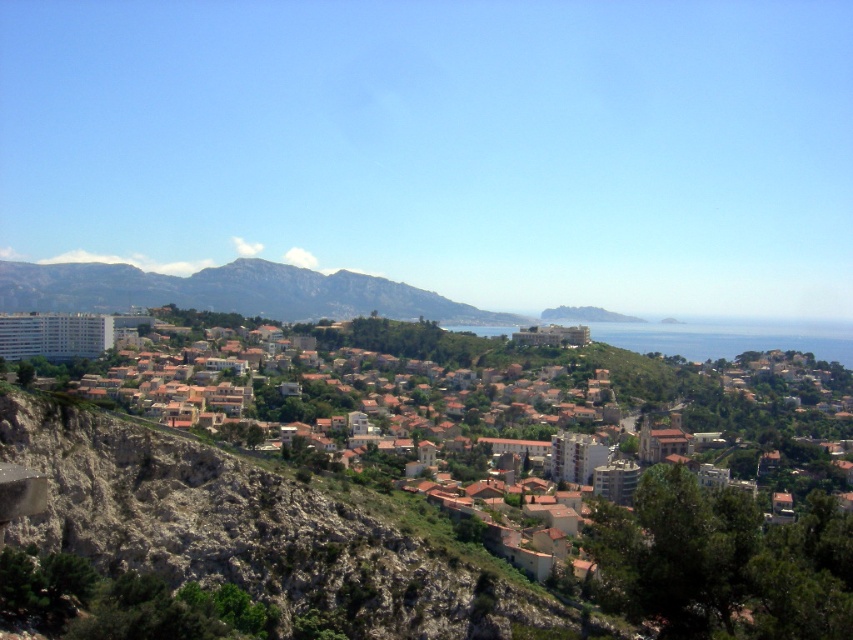
Question: Is white concrete buildings at center further to the viewer compared to rocky brown mountain at center?

Choices:
 (A) no
 (B) yes

Answer: (A)

Question: Is white concrete buildings at center closer to camera compared to blue water at center?

Choices:
 (A) no
 (B) yes

Answer: (B)

Question: Based on their relative distances, which object is farther from the blue water at center?

Choices:
 (A) white concrete buildings at center
 (B) rocky brown mountain at center

Answer: (A)

Question: Which of the following is the closest to the observer?

Choices:
 (A) rocky brown mountain at center
 (B) white concrete buildings at center

Answer: (B)

Question: Does white concrete buildings at center appear on the left side of rocky brown mountain at center?

Choices:
 (A) yes
 (B) no

Answer: (B)

Question: Among these objects, which one is nearest to the camera?

Choices:
 (A) rocky brown mountain at center
 (B) white concrete buildings at center

Answer: (B)